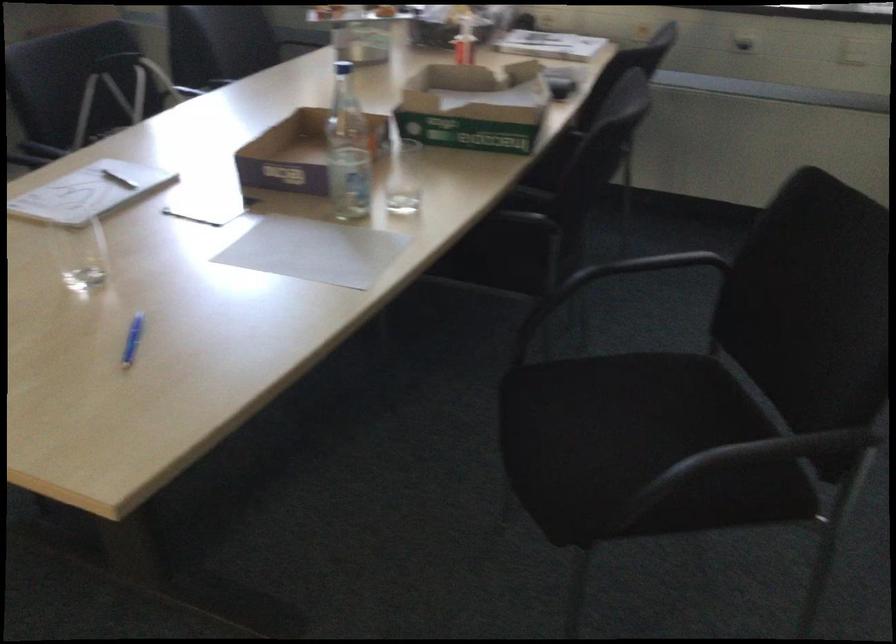
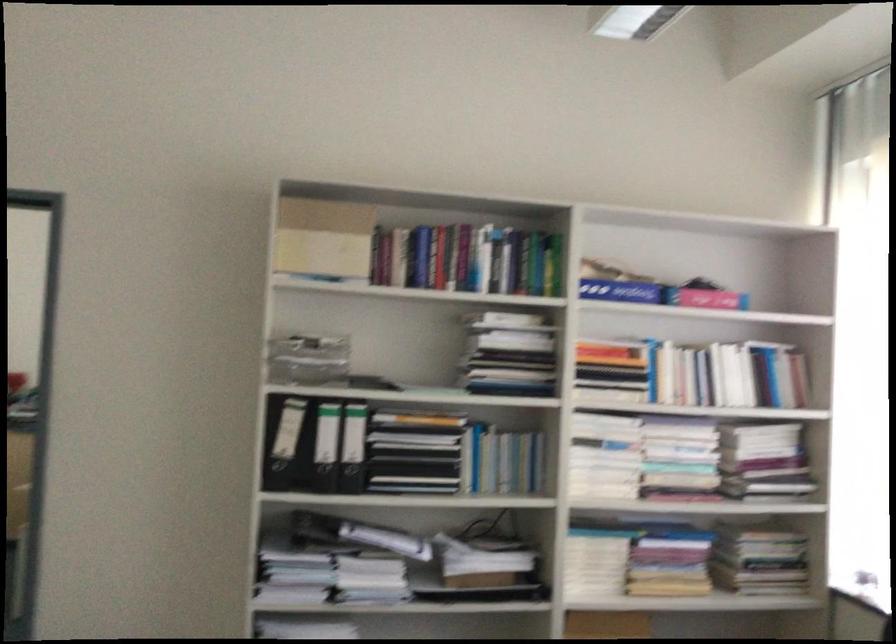
The images are taken continuously from a first-person perspective. In which direction is your viewpoint rotating?

The camera rotated toward left-up.